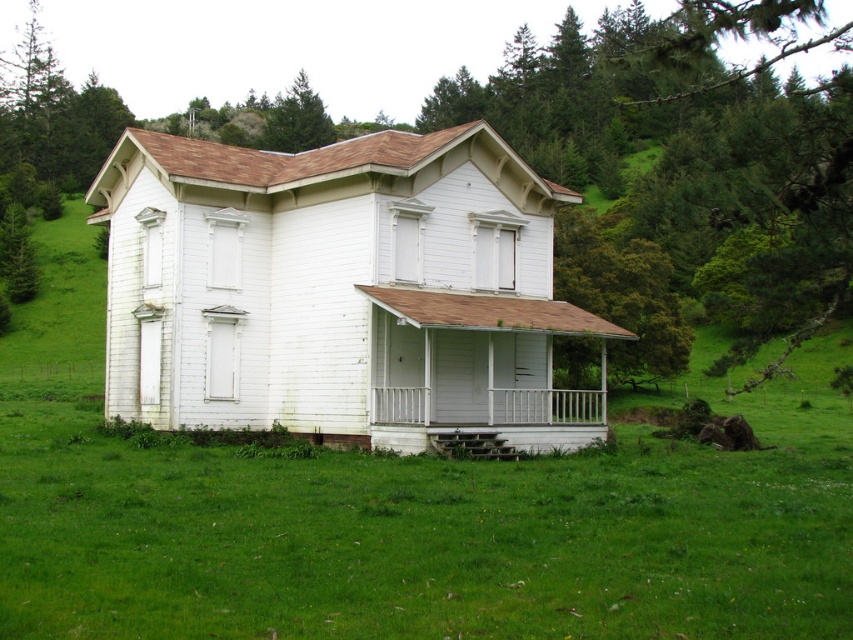
You are standing in front of the house and want to enter through the front door. Which object, the white wood house at center or the white wooden porch at center, do you need to approach first?

You need to approach the white wooden porch at center first because the white wood house at center is located above it, meaning the porch is at the lower level leading to the entrance.

You are standing in the middle of a field looking at the white wood house at center and the green textured tree at upper center. Which object is taller?

The green textured tree at upper center is taller than the white wood house at center.